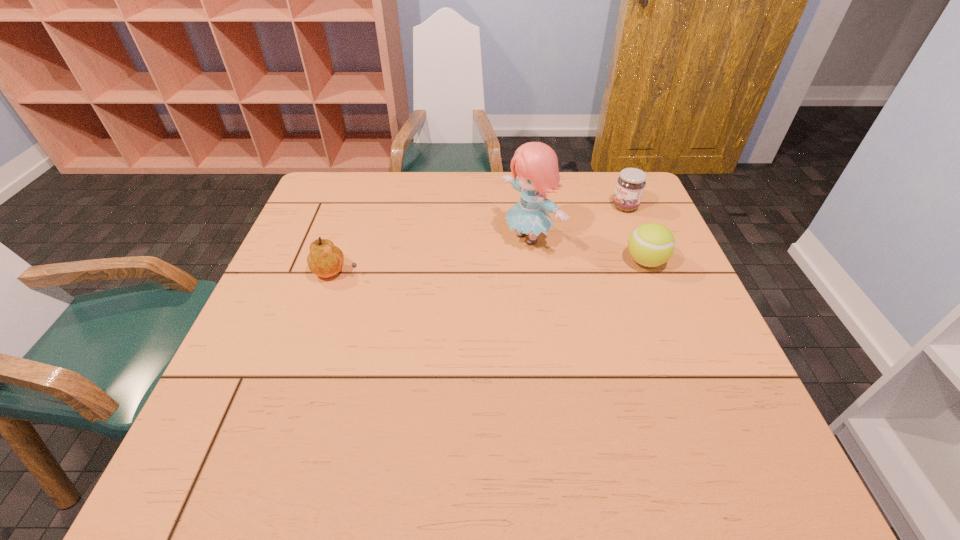
This screenshot has height=540, width=960. In the image, there is a desktop. Find the location of `vacant space at the near edge`. vacant space at the near edge is located at coordinates tap(560, 419).

The height and width of the screenshot is (540, 960). Identify the location of vacant point at the left edge. (301, 274).

Locate an element on the screen. Image resolution: width=960 pixels, height=540 pixels. vacant space at the right edge is located at coordinates (693, 289).

Where is `free space at the far left corner of the desktop`? The width and height of the screenshot is (960, 540). free space at the far left corner of the desktop is located at coordinates (349, 196).

At what (x,y) coordinates should I click in order to perform the action: click on free spot at the near right corner of the desktop. Please return your answer as a coordinate pair (x, y). This screenshot has height=540, width=960. Looking at the image, I should click on (667, 388).

Where is `vacant area that lies between the pear and the doll`? vacant area that lies between the pear and the doll is located at coordinates (433, 255).

The width and height of the screenshot is (960, 540). In order to click on vacant space in between the tennis ball and the pear in this screenshot , I will do `click(492, 267)`.

In order to click on free spot between the tennis ball and the tallest object in this screenshot , I will do `click(588, 249)`.

You are a GUI agent. You are given a task and a screenshot of the screen. Output one action in this format:
    pyautogui.click(x=<x>, y=<y>)
    Task: Click on the unoccupied position between the third object from right to left and the tennis ball
    This screenshot has width=960, height=540.
    Given the screenshot: What is the action you would take?
    pyautogui.click(x=588, y=249)

Identify the location of empty space between the second object from left to right and the farthest object. This screenshot has height=540, width=960. (577, 222).